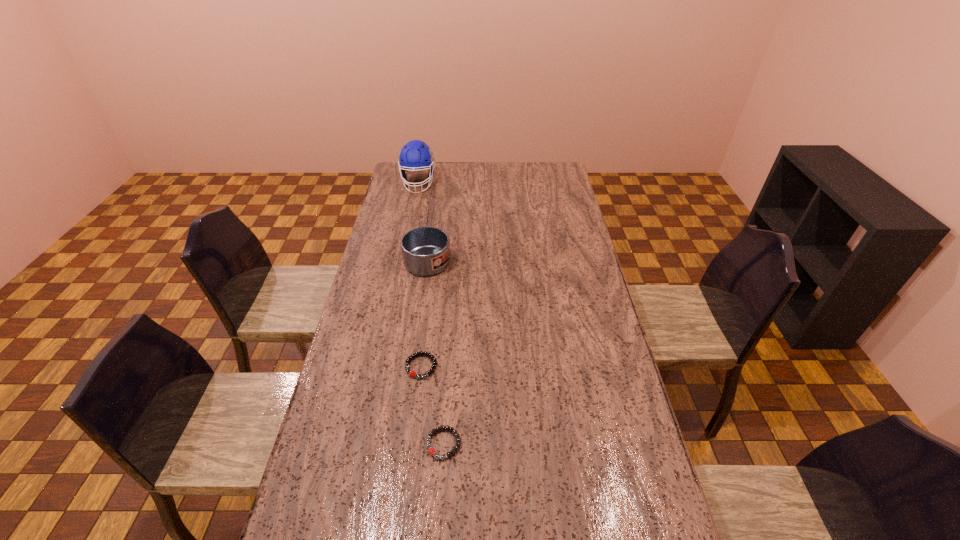
Find the location of a particular element. free spot that satisfies the following two spatial constraints: 1. on the face guard of the farther bracelet; 2. on the right side of the tallest object is located at coordinates (381, 367).

This screenshot has width=960, height=540. I want to click on free space that satisfies the following two spatial constraints: 1. on the face guard of the tallest object; 2. on the right side of the nearest object, so click(x=365, y=444).